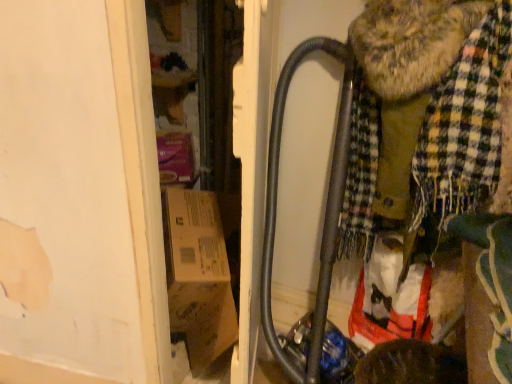
Question: Considering the relative positions of plaid fabric scarf at right and metallic gray baby carriage at center-right in the image provided, is plaid fabric scarf at right to the left or to the right of metallic gray baby carriage at center-right?

Choices:
 (A) right
 (B) left

Answer: (B)

Question: Considering the positions of plaid fabric scarf at right and metallic gray baby carriage at center-right in the image, is plaid fabric scarf at right wider or thinner than metallic gray baby carriage at center-right?

Choices:
 (A) wide
 (B) thin

Answer: (B)

Question: Is point (431, 162) positioned closer to the camera than point (368, 165)?

Choices:
 (A) closer
 (B) farther

Answer: (A)

Question: Would you say metallic gray baby carriage at center-right is to the left or to the right of plaid fabric scarf at right in the picture?

Choices:
 (A) right
 (B) left

Answer: (A)

Question: From a real-world perspective, is metallic gray baby carriage at center-right above or below plaid fabric scarf at right?

Choices:
 (A) below
 (B) above

Answer: (B)

Question: Considering the positions of metallic gray baby carriage at center-right and plaid fabric scarf at right in the image, is metallic gray baby carriage at center-right bigger or smaller than plaid fabric scarf at right?

Choices:
 (A) small
 (B) big

Answer: (A)

Question: From the image's perspective, is metallic gray baby carriage at center-right above or below plaid fabric scarf at right?

Choices:
 (A) below
 (B) above

Answer: (B)